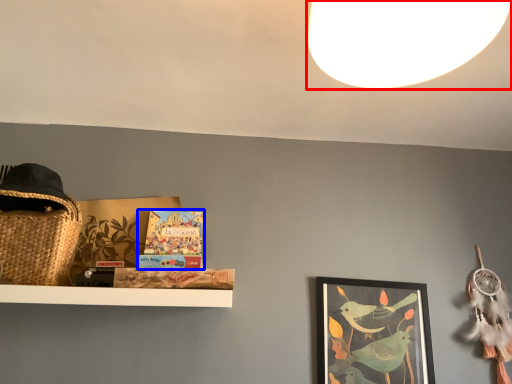
Question: Which object is closer to the camera taking this photo, light (highlighted by a red box) or book (highlighted by a blue box)?

Choices:
 (A) light
 (B) book

Answer: (A)